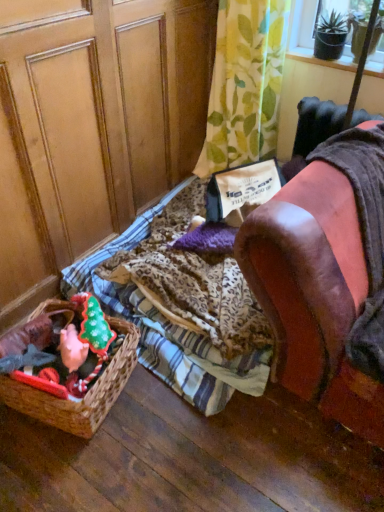
Question: From the image's perspective, is transparent plastic screen at upper right on leather armchair at right?

Choices:
 (A) no
 (B) yes

Answer: (B)

Question: Are transparent plastic screen at upper right and leather armchair at right beside each other?

Choices:
 (A) yes
 (B) no

Answer: (B)

Question: From a real-world perspective, does transparent plastic screen at upper right stand above leather armchair at right?

Choices:
 (A) no
 (B) yes

Answer: (B)

Question: Considering the relative sizes of transparent plastic screen at upper right and leather armchair at right in the image provided, is transparent plastic screen at upper right taller than leather armchair at right?

Choices:
 (A) no
 (B) yes

Answer: (A)

Question: Is transparent plastic screen at upper right positioned beyond the bounds of leather armchair at right?

Choices:
 (A) no
 (B) yes

Answer: (B)

Question: Considering the relative sizes of transparent plastic screen at upper right and leather armchair at right in the image provided, is transparent plastic screen at upper right bigger than leather armchair at right?

Choices:
 (A) no
 (B) yes

Answer: (A)

Question: Is wooden screen door at left positioned in front of brown woven basket at lower left?

Choices:
 (A) yes
 (B) no

Answer: (A)

Question: Can you confirm if wooden screen door at left is smaller than brown woven basket at lower left?

Choices:
 (A) yes
 (B) no

Answer: (B)

Question: Is wooden screen door at left surrounding brown woven basket at lower left?

Choices:
 (A) no
 (B) yes

Answer: (A)

Question: Does wooden screen door at left have a lesser height compared to brown woven basket at lower left?

Choices:
 (A) yes
 (B) no

Answer: (B)

Question: Is wooden screen door at left positioned behind brown woven basket at lower left?

Choices:
 (A) yes
 (B) no

Answer: (B)

Question: Is wooden screen door at left far away from brown woven basket at lower left?

Choices:
 (A) no
 (B) yes

Answer: (A)

Question: Is green leafy fabric at upper center wider than brown woven basket at lower left?

Choices:
 (A) no
 (B) yes

Answer: (A)